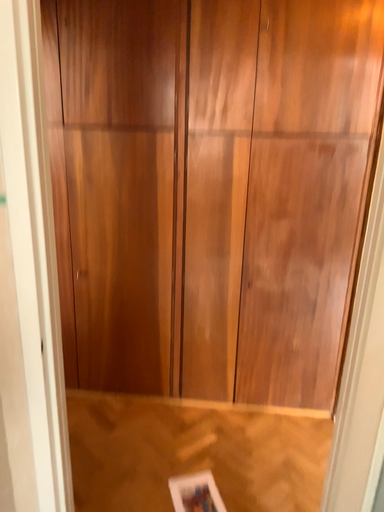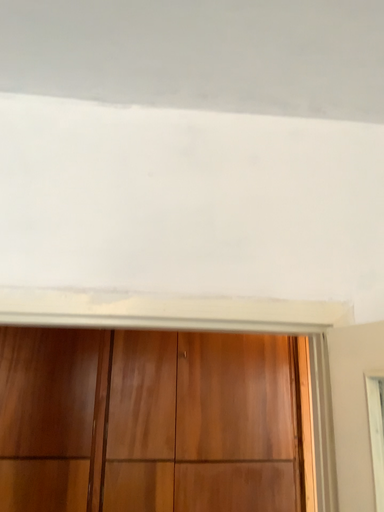
Question: Which way did the camera rotate in the video?

Choices:
 (A) rotated right
 (B) rotated left

Answer: (A)